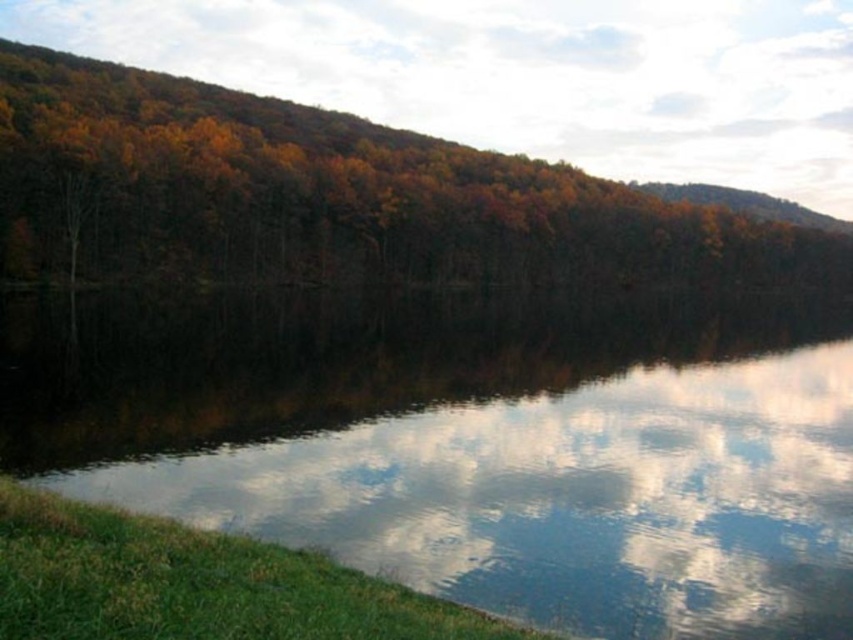
From the picture: Does clear water at lower left appear on the right side of autumn leaves at upper left?

No, clear water at lower left is not to the right of autumn leaves at upper left.

Locate an element on the screen. clear water at lower left is located at coordinates (473, 440).